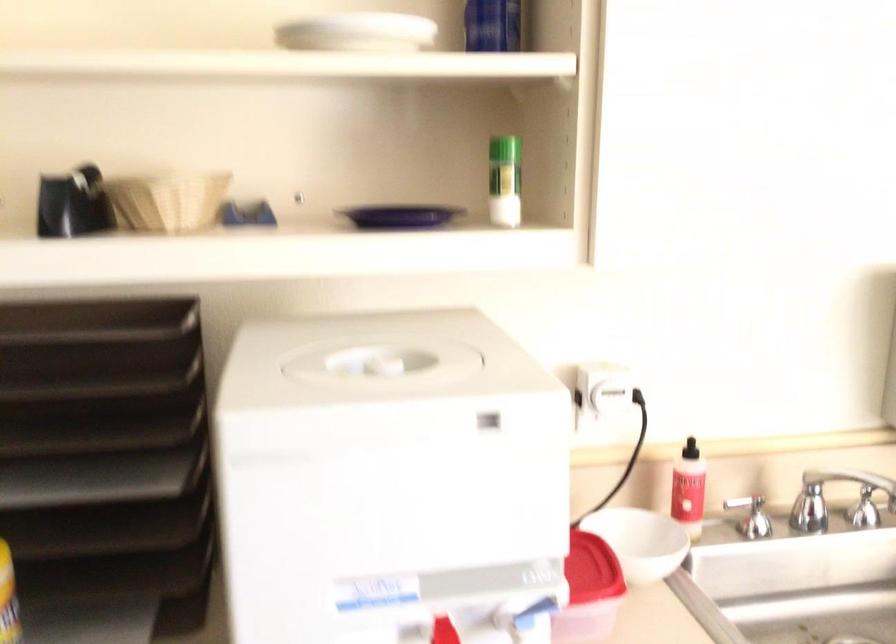
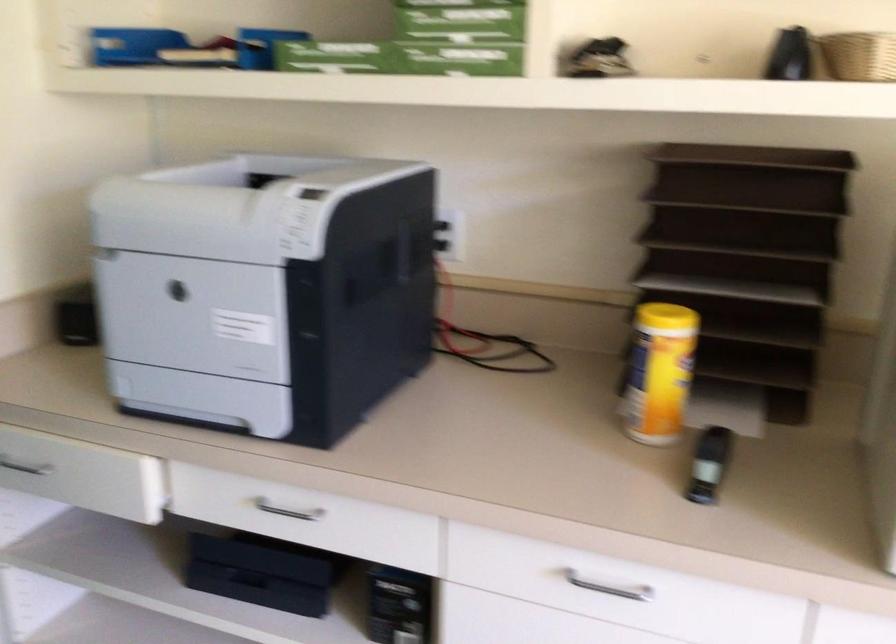
Question: How did the camera likely rotate?

Choices:
 (A) Left
 (B) Right
 (C) Up
 (D) Down

Answer: (A)